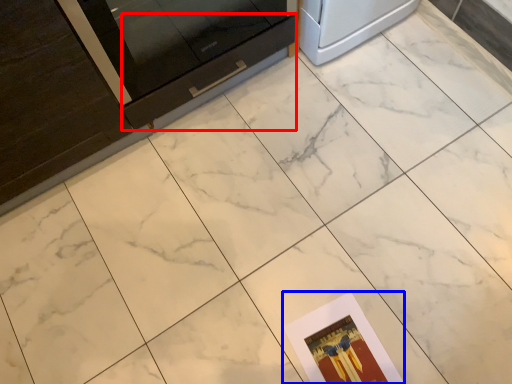
Question: Which object appears farthest to the camera in this image, drawer (highlighted by a red box) or postcard (highlighted by a blue box)?

Choices:
 (A) drawer
 (B) postcard

Answer: (B)